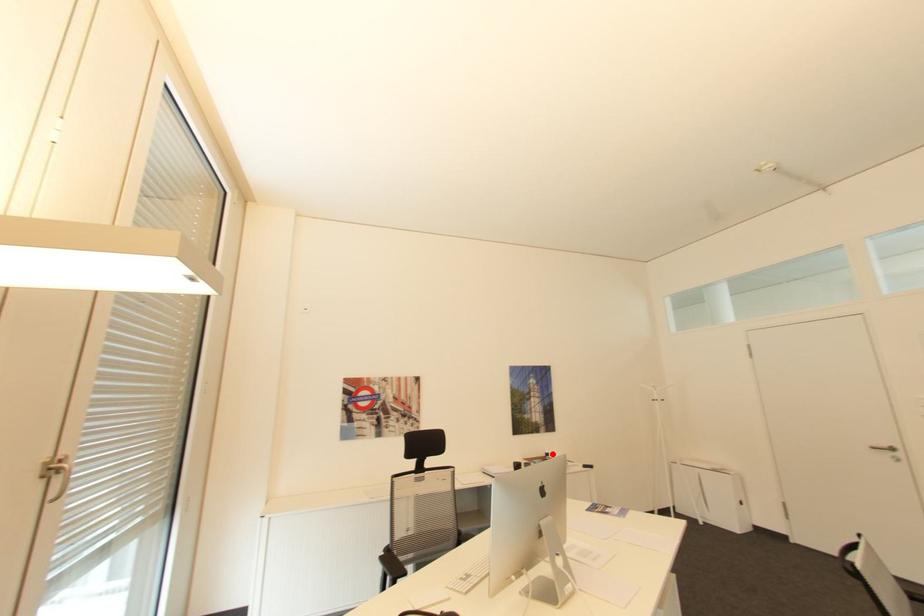
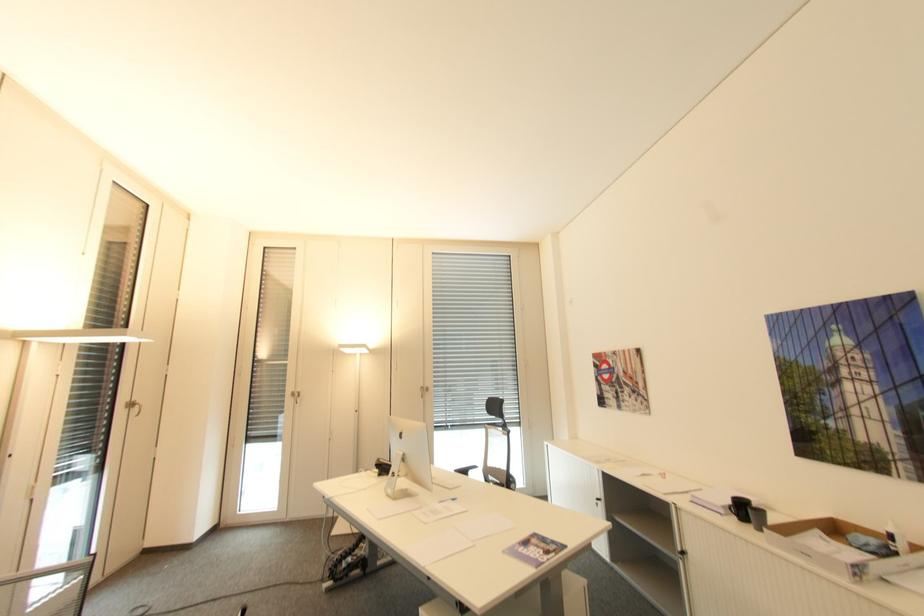
Question: I am providing you with two images of the same scene from different viewpoints. A red point is marked on the first image. Can you still see the location of the red point in image 2?

Choices:
 (A) Yes
 (B) No

Answer: (A)